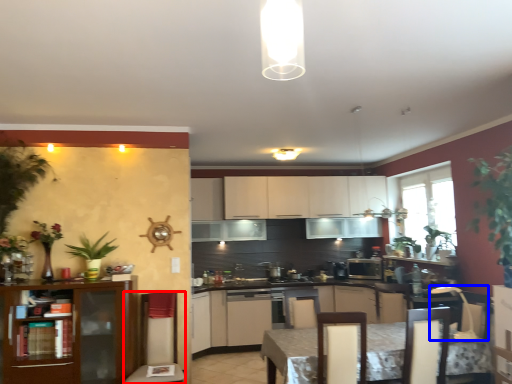
Question: Which point is further to the camera, swivel chair (highlighted by a red box) or swivel chair (highlighted by a blue box)?

Choices:
 (A) swivel chair
 (B) swivel chair

Answer: (A)